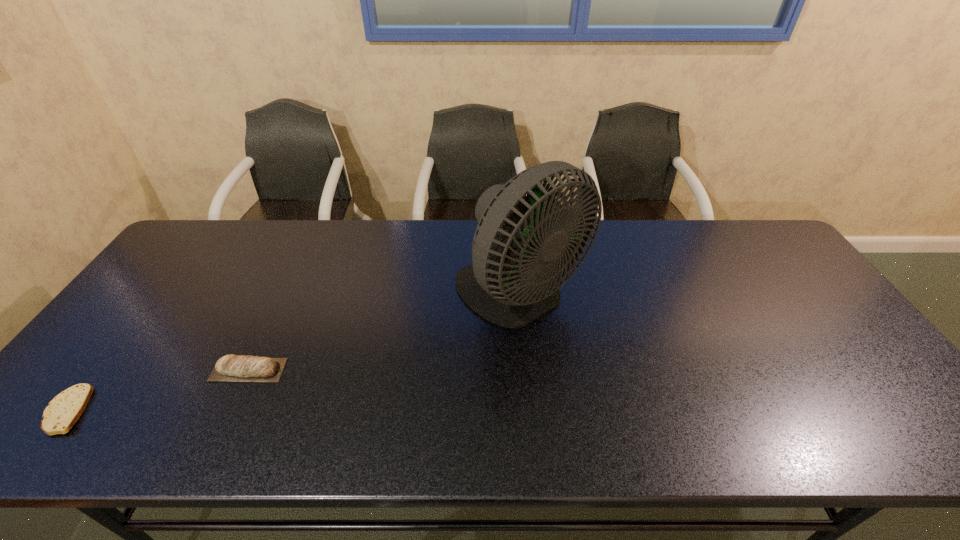
Where is `object that stands as the closest to the leftmost object`? The width and height of the screenshot is (960, 540). object that stands as the closest to the leftmost object is located at coordinates 230,368.

You are a GUI agent. You are given a task and a screenshot of the screen. Output one action in this format:
    pyautogui.click(x=<x>, y=<y>)
    Task: Click on the free location that satisfies the following two spatial constraints: 1. on the back side of the leftmost object; 2. on the left side of the second object from left to right
    
    Given the screenshot: What is the action you would take?
    pyautogui.click(x=100, y=370)

You are a GUI agent. You are given a task and a screenshot of the screen. Output one action in this format:
    pyautogui.click(x=<x>, y=<y>)
    Task: Click on the vacant space that satisfies the following two spatial constraints: 1. on the back side of the nearest object; 2. on the right side of the second object from right to left
    This screenshot has width=960, height=540.
    Given the screenshot: What is the action you would take?
    click(100, 370)